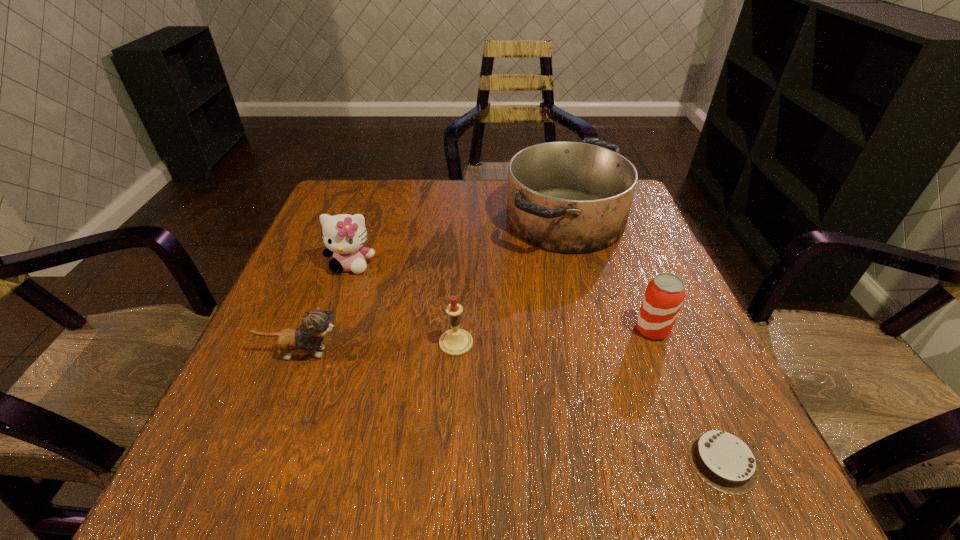
The width and height of the screenshot is (960, 540). Find the location of `vacant point that satisfies the following two spatial constraints: 1. on the front side of the saucepan; 2. on the left side of the shortest object`. vacant point that satisfies the following two spatial constraints: 1. on the front side of the saucepan; 2. on the left side of the shortest object is located at coordinates (628, 462).

At what (x,y) coordinates should I click in order to perform the action: click on vacant space that satisfies the following two spatial constraints: 1. on the front-facing side of the nearer kitten; 2. on the right side of the shortest object. Please return your answer as a coordinate pair (x, y). The height and width of the screenshot is (540, 960). Looking at the image, I should click on (260, 462).